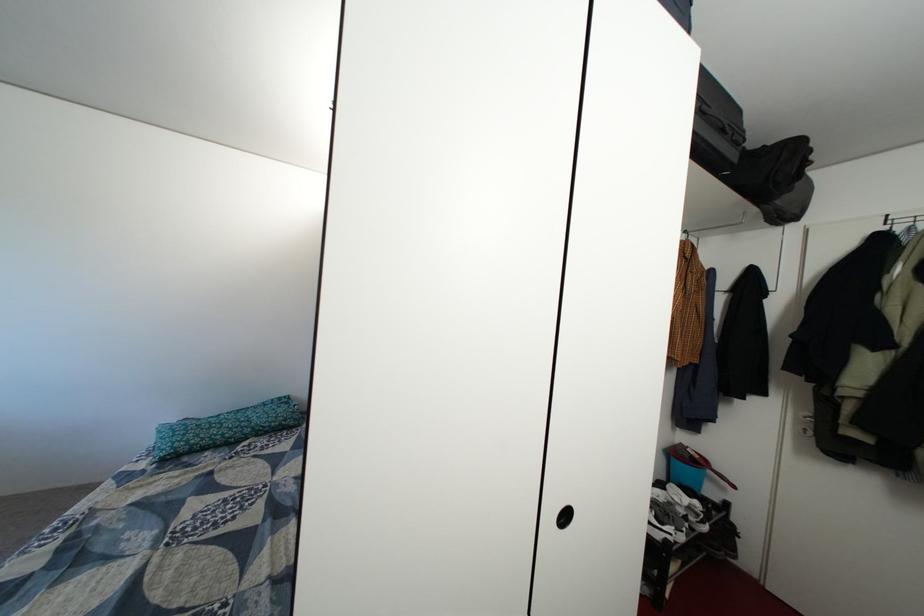
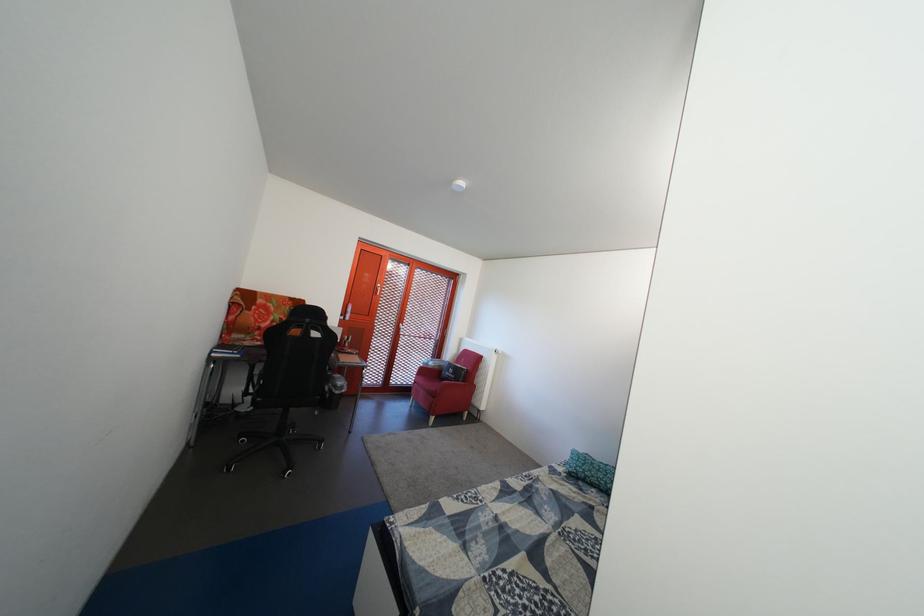
Question: Based on the continuous images, in which direction is the camera rotating? Reply with the corresponding letter.

Choices:
 (A) Left
 (B) Right
 (C) Up
 (D) Down

Answer: (A)